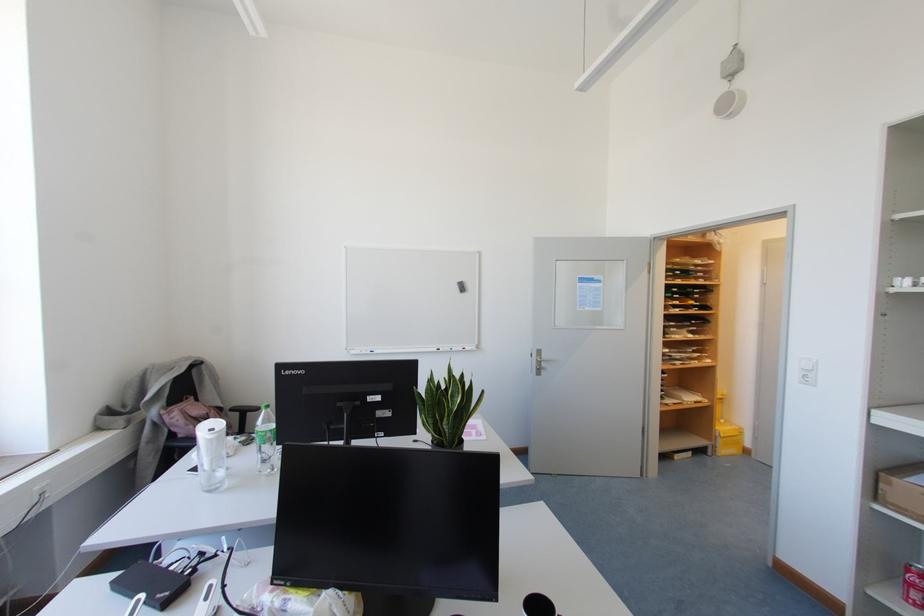
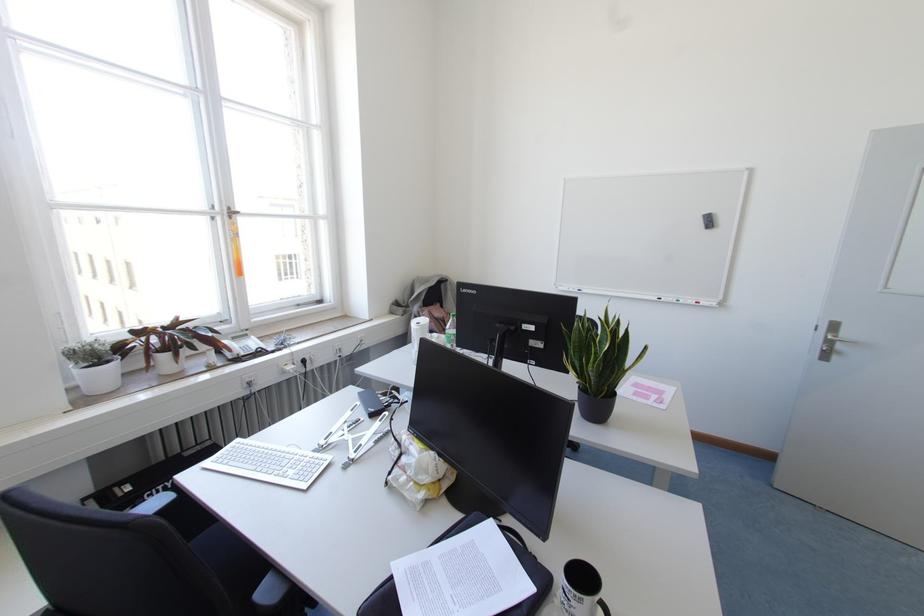
Find the pixel in the second image that matches [438,349] in the first image.

(659, 299)